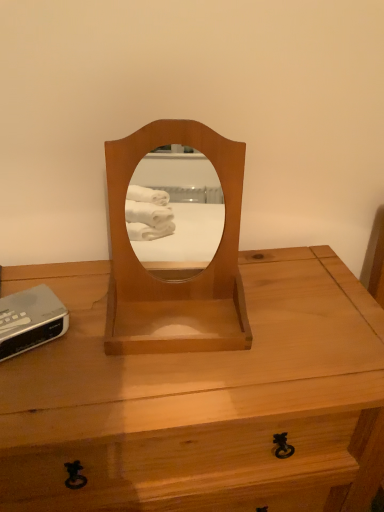
Question: Based on their sizes in the image, would you say silver plastic clock at lower left is bigger or smaller than light brown wood desk at center?

Choices:
 (A) small
 (B) big

Answer: (A)

Question: From the image's perspective, is silver plastic clock at lower left above or below light brown wood desk at center?

Choices:
 (A) above
 (B) below

Answer: (A)

Question: Estimate the real-world distances between objects in this image. Which object is closer to the silver plastic clock at lower left?

Choices:
 (A) light brown wood mirror at center
 (B) light brown wood desk at center

Answer: (A)

Question: Which object is positioned farthest from the silver plastic clock at lower left?

Choices:
 (A) light brown wood mirror at center
 (B) light brown wood desk at center

Answer: (B)